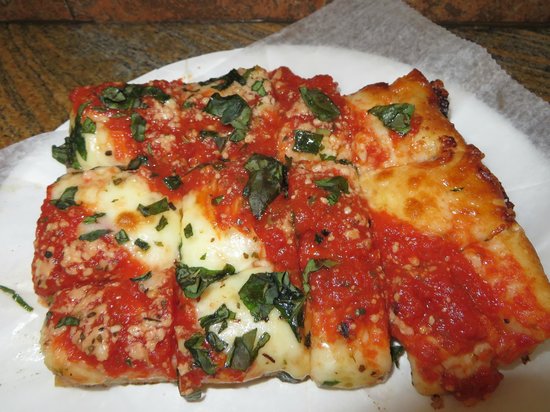
Find the location of `back wall`. back wall is located at coordinates click(x=55, y=10), click(x=125, y=13), click(x=249, y=13), click(x=452, y=15).